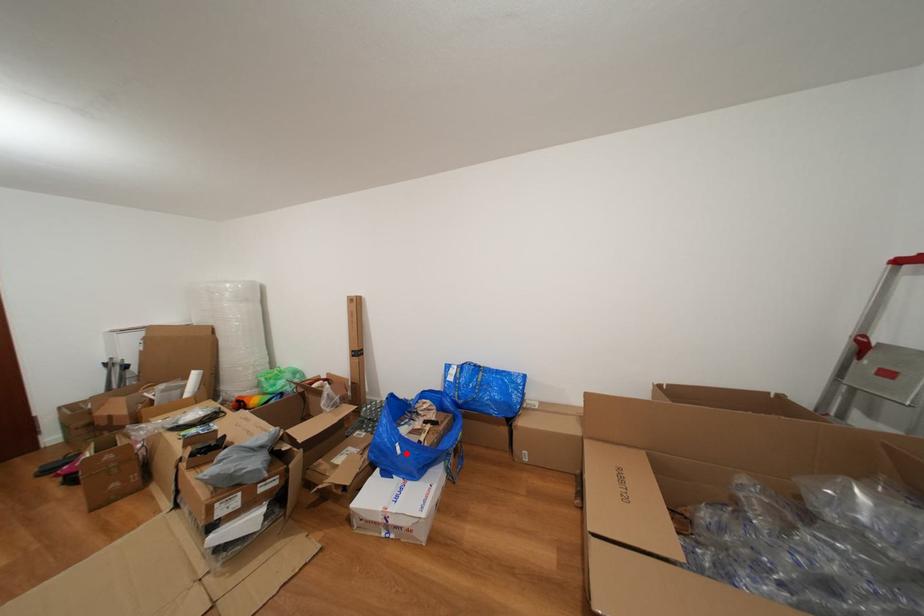
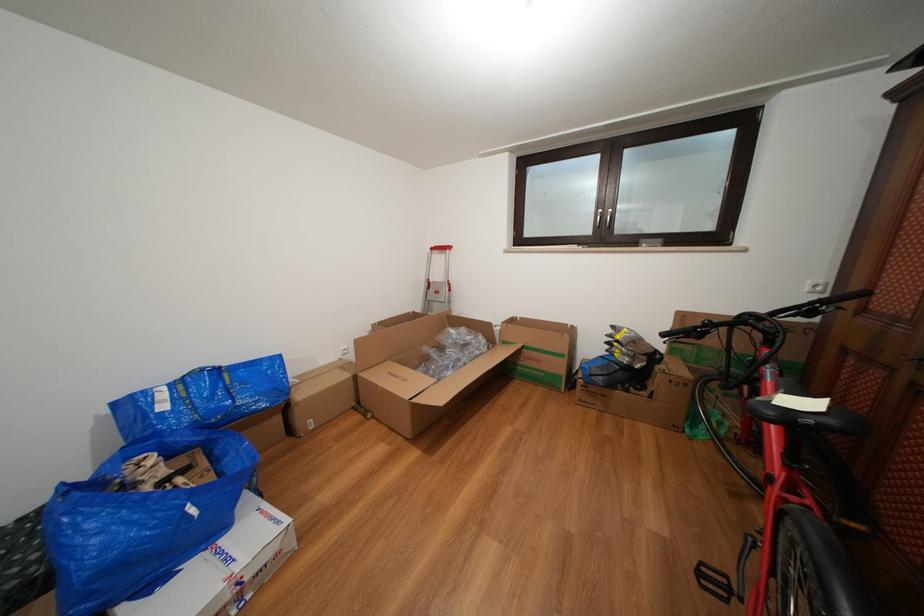
Question: I am providing you with two images of the same scene from different viewpoints. A red point is shown in image1. For the corresponding object point in image2, is it positioned nearer or farther from the camera?

Choices:
 (A) Nearer
 (B) Farther

Answer: (B)